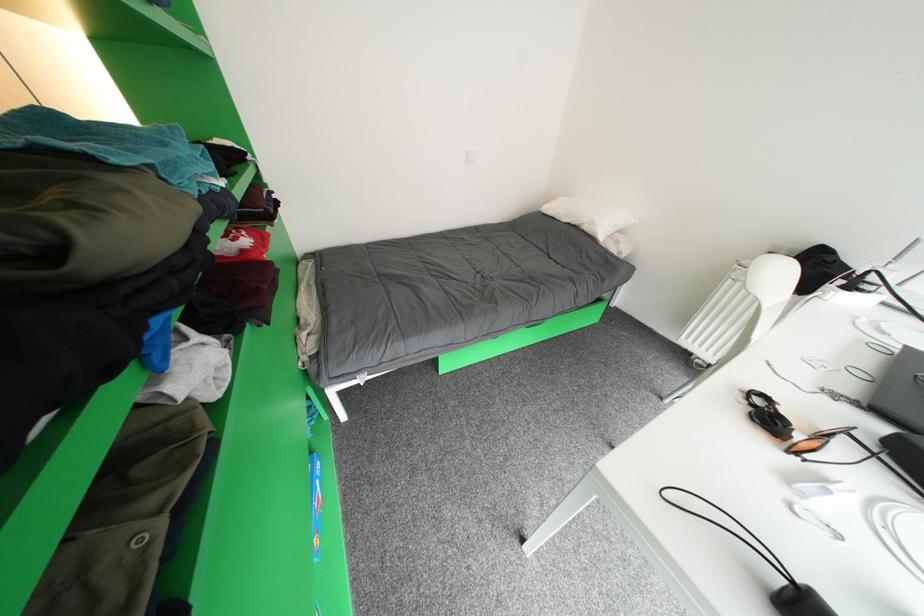
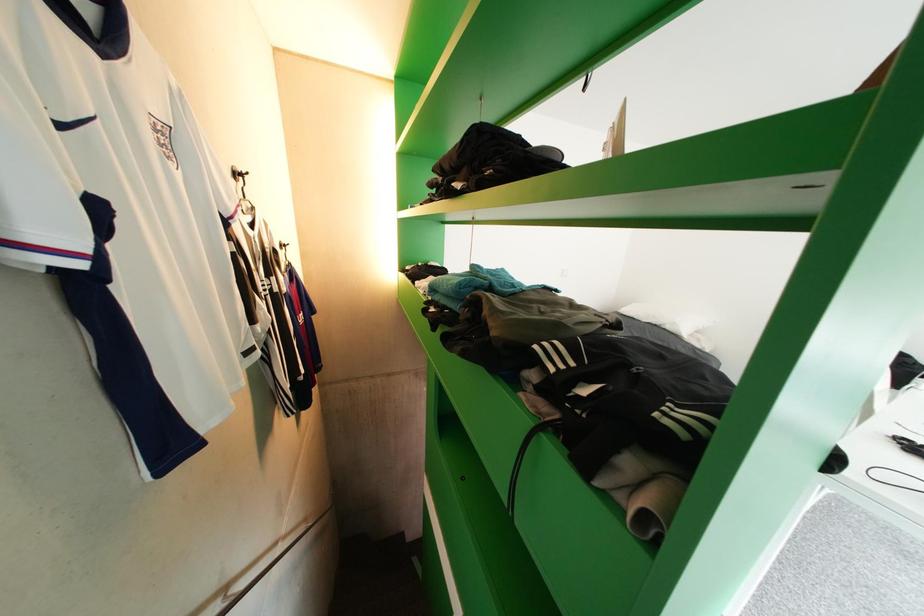
Question: The first image is from the beginning of the video and the second image is from the end. How did the camera likely rotate when shooting the video?

Choices:
 (A) Left
 (B) Right
 (C) Up
 (D) Down

Answer: (C)